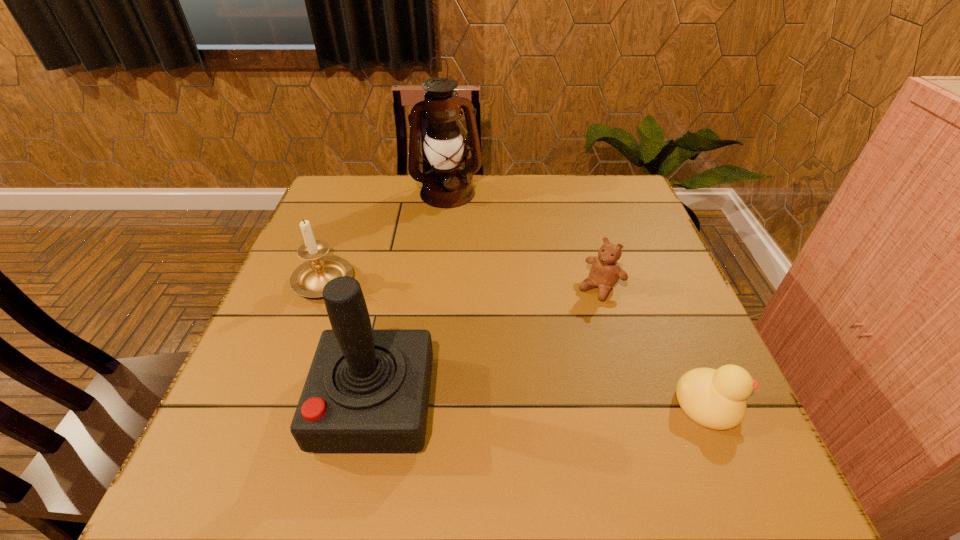
Where is `joystick at the near edge`? The width and height of the screenshot is (960, 540). joystick at the near edge is located at coordinates (367, 390).

Find the location of `duckling at the near edge`. duckling at the near edge is located at coordinates (715, 399).

Locate an element on the screen. The image size is (960, 540). object located in the left edge section of the desktop is located at coordinates (308, 280).

Locate an element on the screen. duckling positioned at the right edge is located at coordinates (715, 399).

You are a GUI agent. You are given a task and a screenshot of the screen. Output one action in this format:
    pyautogui.click(x=<x>, y=<y>)
    Task: Click on the teddy bear located in the right edge section of the desktop
    
    Given the screenshot: What is the action you would take?
    pyautogui.click(x=605, y=272)

This screenshot has height=540, width=960. In order to click on object present at the near right corner in this screenshot , I will do `click(715, 399)`.

The height and width of the screenshot is (540, 960). I want to click on vacant point at the far edge, so click(478, 176).

Find the location of `vacant space at the near edge of the desktop`. vacant space at the near edge of the desktop is located at coordinates (448, 394).

In the image, there is a desktop. Where is `vacant space at the left edge`? The image size is (960, 540). vacant space at the left edge is located at coordinates (306, 375).

In the image, there is a desktop. Where is `free region at the right edge`? The width and height of the screenshot is (960, 540). free region at the right edge is located at coordinates (708, 361).